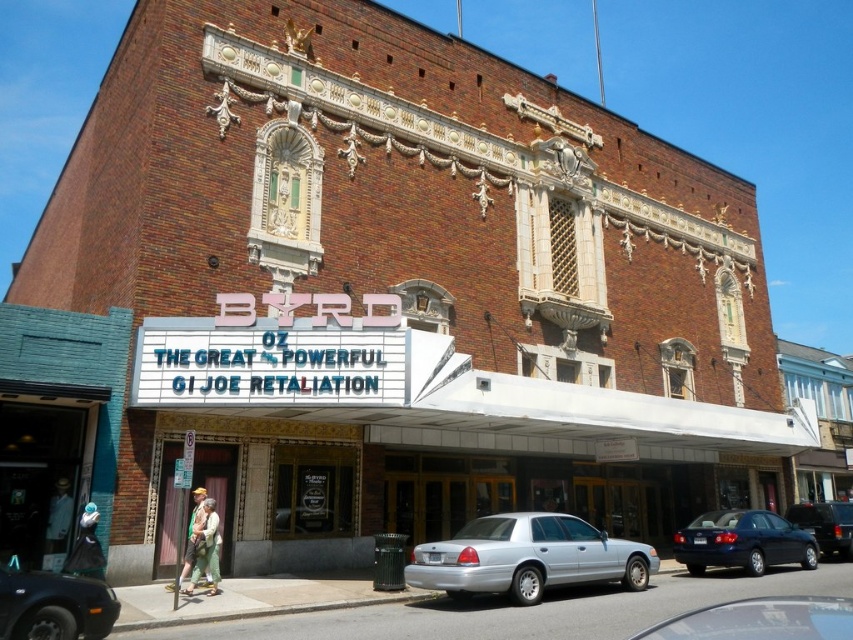
Question: Among these objects, which one is farthest from the camera?

Choices:
 (A) metallic blue sedan at lower right
 (B) shiny silver sedan at center

Answer: (A)

Question: Is shiny silver sedan at center further to the viewer compared to black glossy sedan at center?

Choices:
 (A) no
 (B) yes

Answer: (A)

Question: Considering the real-world distances, which object is closest to the black rubber car at lower left?

Choices:
 (A) metallic blue sedan at lower right
 (B) shiny silver sedan at center
 (C) black glossy sedan at center

Answer: (B)

Question: Can you confirm if shiny silver sedan at center is positioned to the right of black glossy sedan at center?

Choices:
 (A) yes
 (B) no

Answer: (B)

Question: Is silver metallic sedan at center smaller than black glossy sedan at center?

Choices:
 (A) no
 (B) yes

Answer: (A)

Question: Which of these objects is positioned closest to the silver metallic sedan at center?

Choices:
 (A) shiny silver sedan at center
 (B) metallic blue sedan at lower right
 (C) black glossy sedan at center
 (D) black rubber car at lower left

Answer: (A)